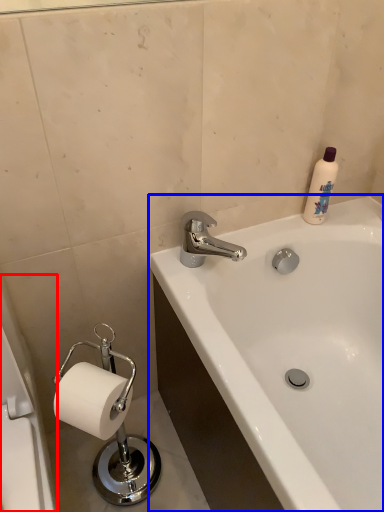
Question: Which object appears farthest to the camera in this image, bath (highlighted by a red box) or bathtub (highlighted by a blue box)?

Choices:
 (A) bath
 (B) bathtub

Answer: (B)